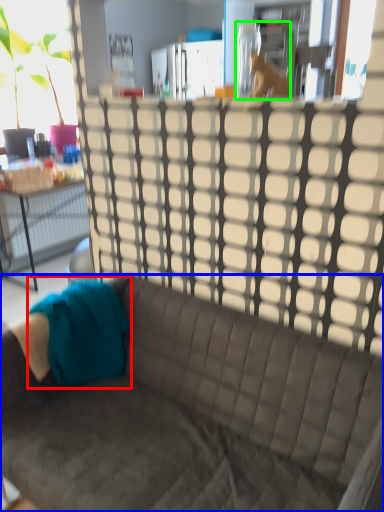
Question: Estimate the real-world distances between objects in this image. Which object is closer to fabric (highlighted by a red box), studio couch (highlighted by a blue box) or animal (highlighted by a green box)?

Choices:
 (A) studio couch
 (B) animal

Answer: (A)